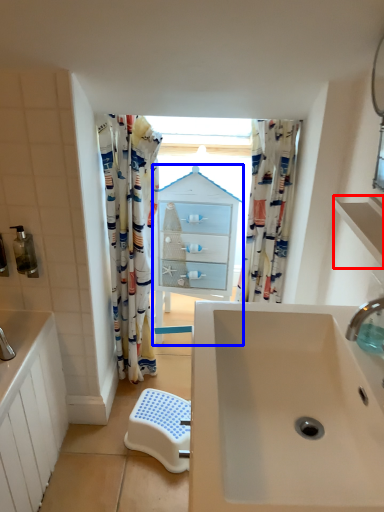
Question: Which point is further to the camera, balustrade (highlighted by a red box) or medicine cabinet (highlighted by a blue box)?

Choices:
 (A) balustrade
 (B) medicine cabinet

Answer: (B)